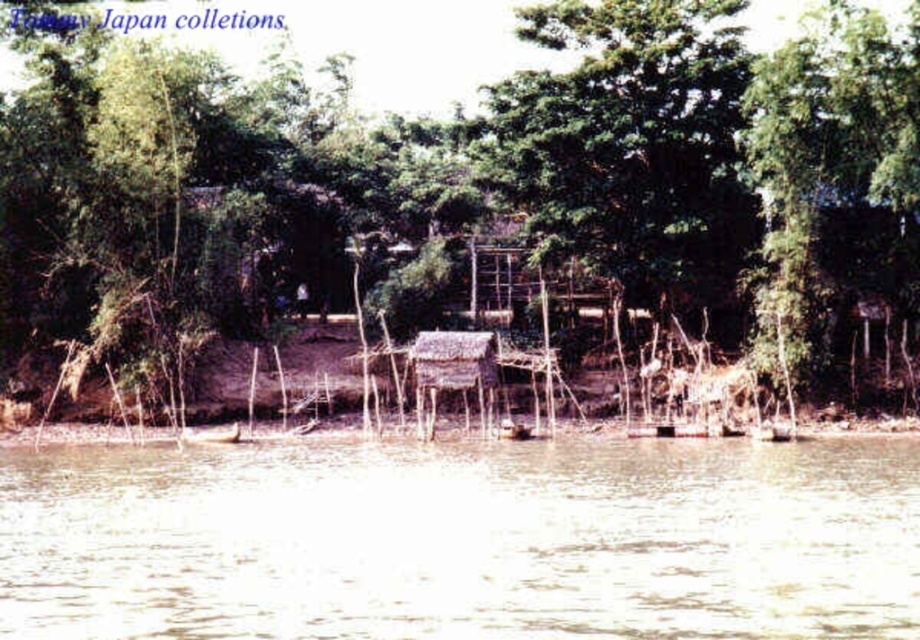
Which of these two, green leafy tree at center or brown muddy water at lower center, stands shorter?

With less height is brown muddy water at lower center.

Is green leafy tree at center further to camera compared to brown muddy water at lower center?

Yes.

This screenshot has width=920, height=640. Identify the location of green leafy tree at center. (641, 156).

At what (x,y) coordinates should I click in order to perform the action: click on green leafy tree at center. Please return your answer as a coordinate pair (x, y). The image size is (920, 640). Looking at the image, I should click on click(641, 156).